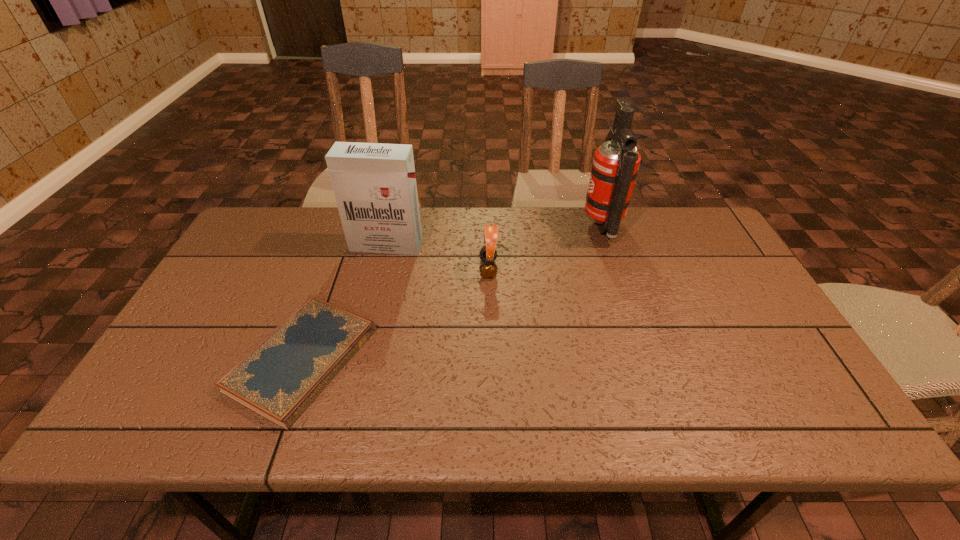
What are the coordinates of `vacant space at the left edge of the desktop` in the screenshot? It's located at (263, 276).

Image resolution: width=960 pixels, height=540 pixels. In the image, there is a desktop. Identify the location of vacant space at the right edge. (757, 353).

This screenshot has width=960, height=540. I want to click on vacant space at the far left corner, so click(x=260, y=239).

Identify the location of free space at the far right corner. (686, 208).

The width and height of the screenshot is (960, 540). I want to click on vacant space at the near right corner of the desktop, so tap(765, 419).

Find the location of a particular element. This screenshot has height=540, width=960. free point between the rightmost object and the third tallest object is located at coordinates [545, 248].

Identify the location of free space between the shortest object and the second object from right to left. The height and width of the screenshot is (540, 960). (396, 314).

Locate an element on the screen. This screenshot has width=960, height=540. vacant region between the second nearest object and the cigarette case is located at coordinates (437, 256).

This screenshot has width=960, height=540. In order to click on free point between the fire extinguisher and the second nearest object in this screenshot , I will do `click(545, 248)`.

Where is `free space between the cigarette case and the nearest object`? The height and width of the screenshot is (540, 960). free space between the cigarette case and the nearest object is located at coordinates (345, 302).